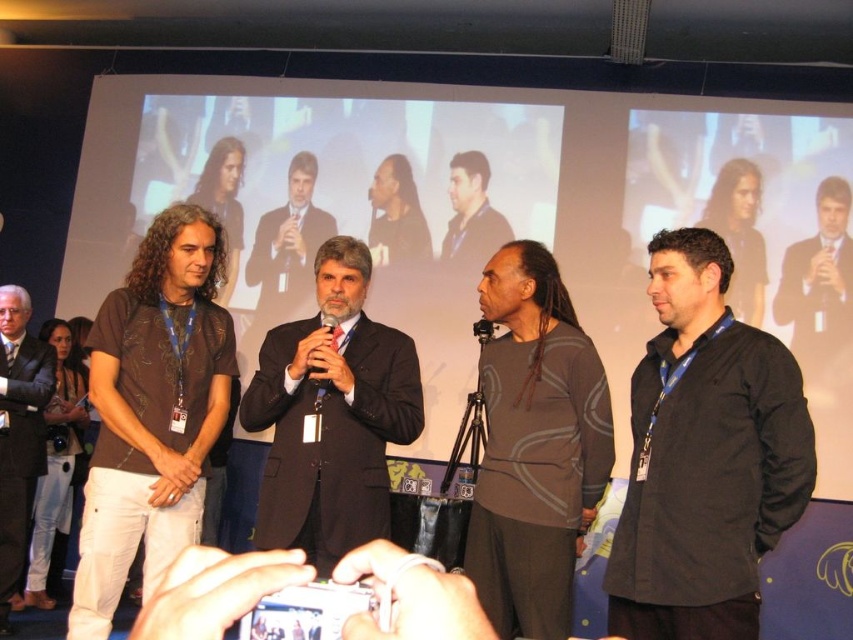
You are attending a conference and notice two presenters on stage wearing dark suit at center and dark brown suit at center. Which presenter is shorter?

The dark suit at center is shorter than the dark brown suit at center.

You are an event photographer who needs to capture a photo of the speaker holding the black plastic microphone at center. However, you notice the brown matte shirt at left might be blocking the view. Based on their positions, can you adjust your angle to ensure the microphone is visible without the shirt obscuring it?

The brown matte shirt at left is to the left of the black plastic microphone at center, so by positioning yourself to the right side of the microphone, you can avoid the shirt blocking the view and ensure the microphone remains visible.